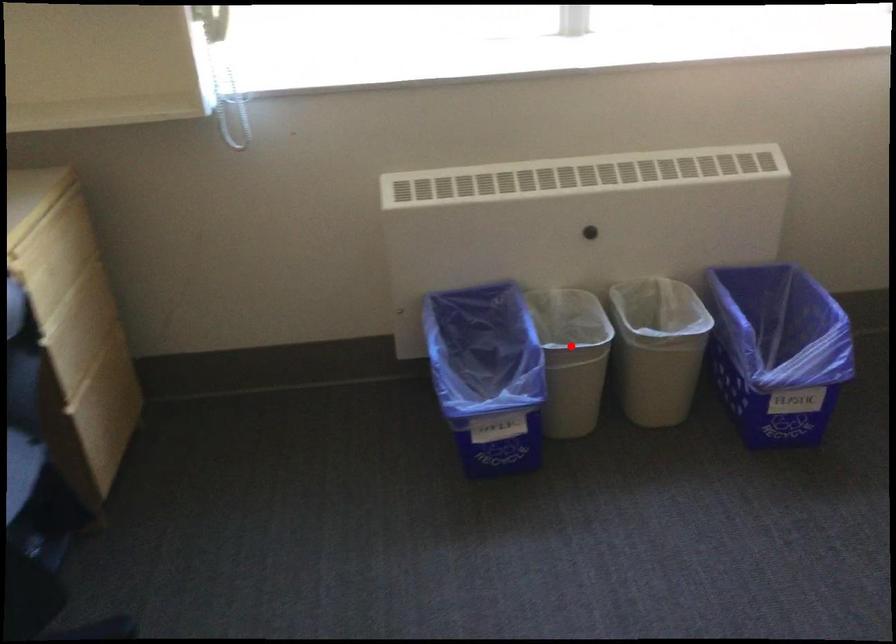
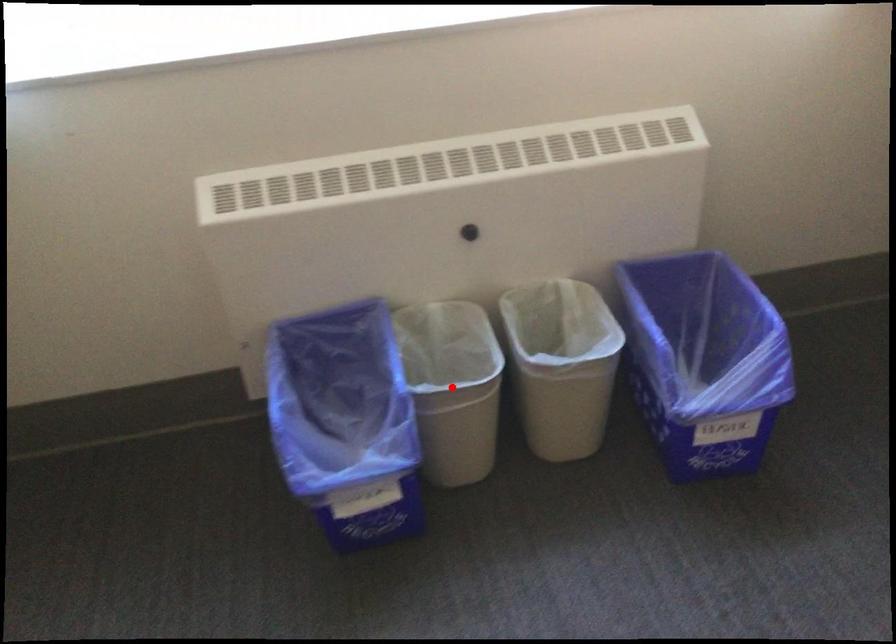
I am providing you with two images of the same scene from different viewpoints. A red point is marked on the first image and another point is marked on the second image. Is the marked point in image1 the same physical position as the marked point in image2?

Yes